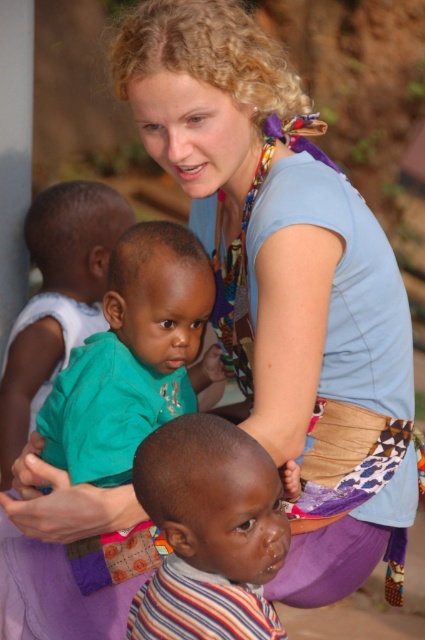
You are a photographer trying to capture a candid shot of the two children wearing the striped fabric shirt at center and the green matte shirt at center. Since you want to ensure both are fully visible in the frame, which child should you position closer to the camera?

The striped fabric shirt at center is shorter than the green matte shirt at center, so you should position the child wearing the striped fabric shirt at center closer to the camera to ensure both are fully visible in the frame.

You are a photographer trying to capture a clear shot of both the striped fabric shirt at center and the green matte shirt at center. Since you can only focus on one shirt at a time, which one should you focus on to ensure the other is still somewhat in the background?

You should focus on the striped fabric shirt at center because it is in front of the green matte shirt at center, so focusing on the front shirt will keep the background shirt somewhat in focus.